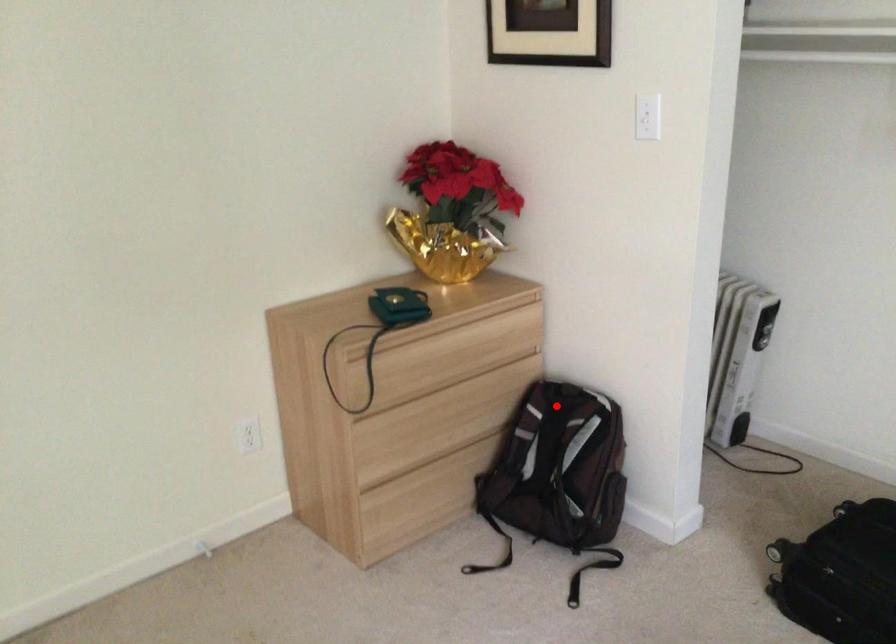
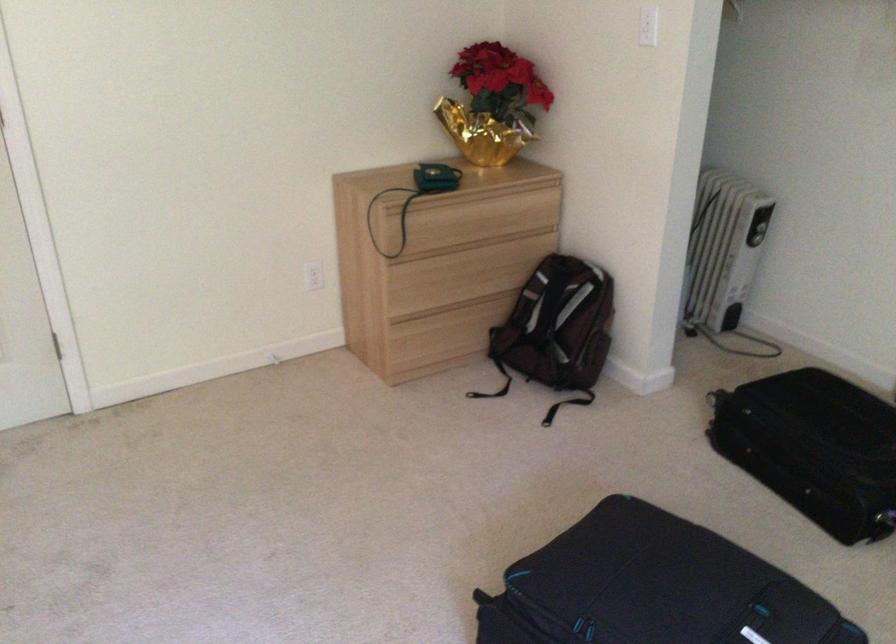
The point at the highlighted location is marked in the first image. Where is the corresponding point in the second image?

(558, 272)